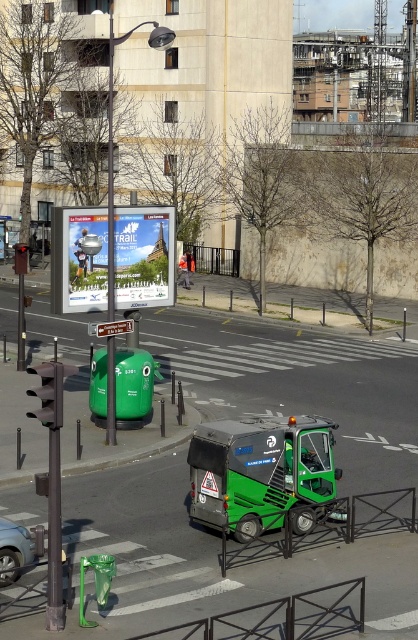
In the scene shown: Is green matte garbage truck at center above metallic silver car at lower left?

Yes.

Does green matte garbage truck at center have a lesser width compared to metallic silver car at lower left?

No.

The width and height of the screenshot is (418, 640). Describe the element at coordinates (260, 472) in the screenshot. I see `green matte garbage truck at center` at that location.

The image size is (418, 640). Find the location of `green matte garbage truck at center`. green matte garbage truck at center is located at coordinates (260, 472).

This screenshot has height=640, width=418. Identify the location of green matte garbage truck at center. (260, 472).

Is green matte garbage truck at center closer to camera compared to matte white poster at center?

That is True.

Find the location of a particular element. green matte garbage truck at center is located at coordinates (260, 472).

You are a GUI agent. You are given a task and a screenshot of the screen. Output one action in this format:
    pyautogui.click(x=<x>, y=<y>)
    Task: Click on the matte white poster at center
    The height and width of the screenshot is (640, 418).
    Given the screenshot: What is the action you would take?
    pyautogui.click(x=143, y=257)

Where is `matte white poster at center`? The width and height of the screenshot is (418, 640). matte white poster at center is located at coordinates (143, 257).